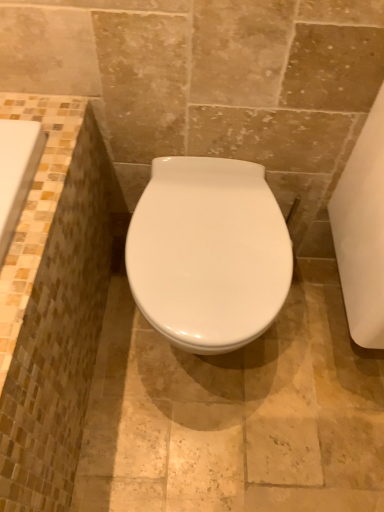
This screenshot has height=512, width=384. What do you see at coordinates (208, 253) in the screenshot?
I see `white glossy toilet at center` at bounding box center [208, 253].

This screenshot has width=384, height=512. I want to click on white glossy toilet at center, so click(x=208, y=253).

Measure the distance between white glossy toilet at center and camera.

white glossy toilet at center and camera are 31.99 inches apart from each other.

Where is `white glossy toilet at center`? The width and height of the screenshot is (384, 512). white glossy toilet at center is located at coordinates (208, 253).